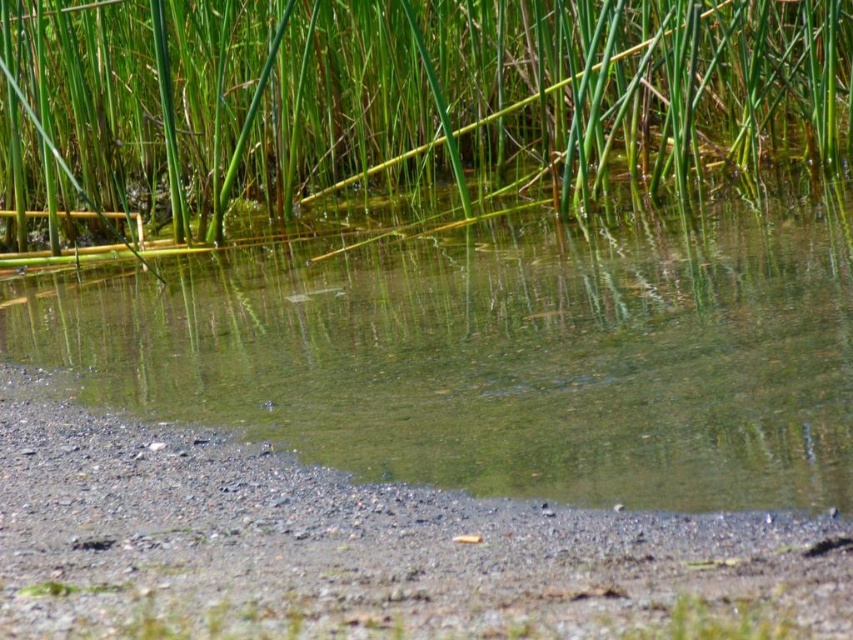
Between clear water at bottom and green grass at upper center, which one has more height?

green grass at upper center is taller.

Is point (436, 285) positioned before point (68, 257)?

Yes, it is in front of point (68, 257).

Where is `clear water at bottom`? The height and width of the screenshot is (640, 853). clear water at bottom is located at coordinates (508, 353).

Is the position of clear water at bottom more distant than that of gray gravelly mud at bottom?

Yes, clear water at bottom is behind gray gravelly mud at bottom.

Which of these two, clear water at bottom or gray gravelly mud at bottom, stands taller?

clear water at bottom

Does point (412, 348) come closer to viewer compared to point (444, 618)?

No, it is not.

Find the location of `clear water at bottom`. clear water at bottom is located at coordinates (508, 353).

Does green grass at upper center appear over gray gravelly mud at bottom?

Yes.

Does point (312, 26) lie behind point (666, 560)?

Yes, it is behind point (666, 560).

Does point (74, 218) lie behind point (775, 632)?

Yes, it is behind point (775, 632).

I want to click on green grass at upper center, so click(392, 108).